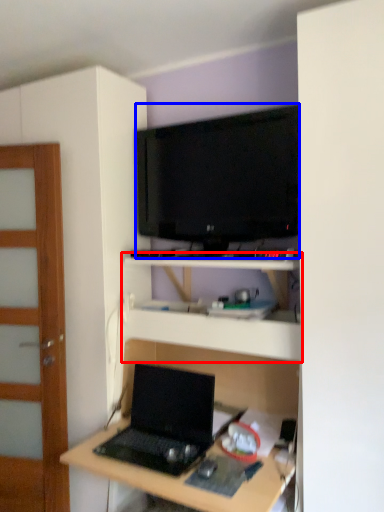
Question: Which object appears closest to the camera in this image, shelf (highlighted by a red box) or television (highlighted by a blue box)?

Choices:
 (A) shelf
 (B) television

Answer: (A)